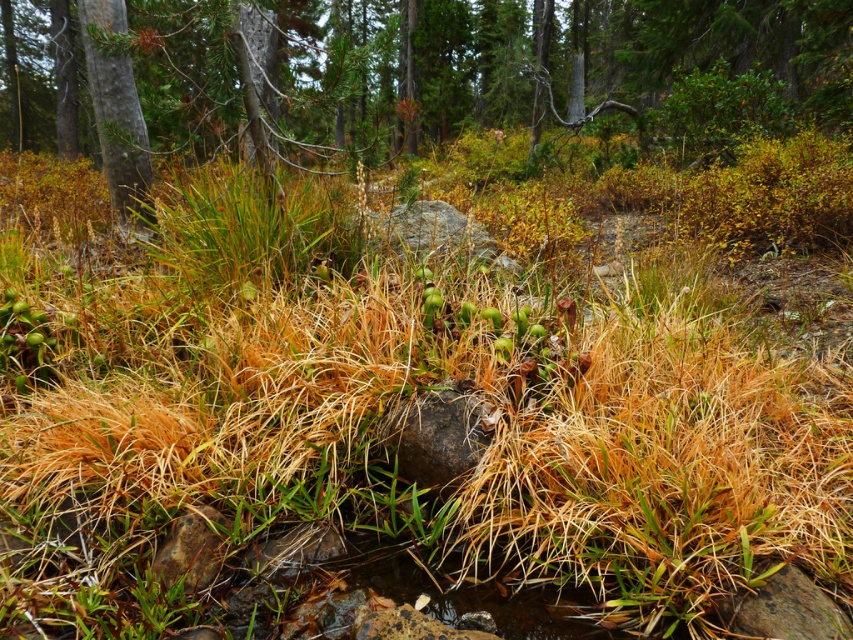
In the scene shown: You are standing in the forest and want to take a photo of the green matte tree at center. If your camera has a maximum focus range of 3 meters, will you need to move closer or farther away to capture it clearly?

The green matte tree at center is 3.31 meters from viewer. Since the camera can only focus up to 3 meters, you need to move closer to be within the 3 meter range.

You are a hiker who wants to take a photo of both the green matte tree at center and the green textured tree at upper left. Which tree should you stand closer to in order to capture both in a single frame?

You should stand closer to the green textured tree at upper left because the green matte tree at center is taller than the green textured tree at upper left, so by positioning yourself nearer to the shorter tree, you can include both trees within the camera frame more effectively.

You are standing in the forest scene described. You see a point marked at coordinates (553, 68). What object is located at that point?

The point at coordinates (553, 68) marks the green matte tree at center.